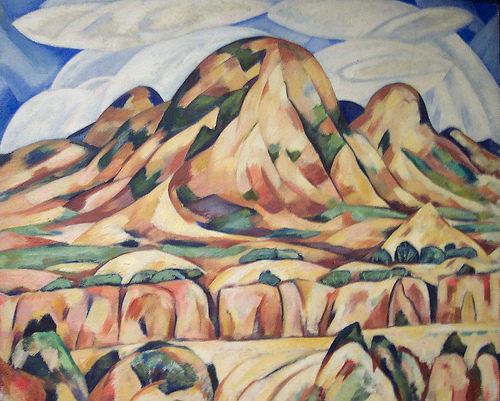
Where is `picture`? This screenshot has height=401, width=500. picture is located at coordinates (x=298, y=233).